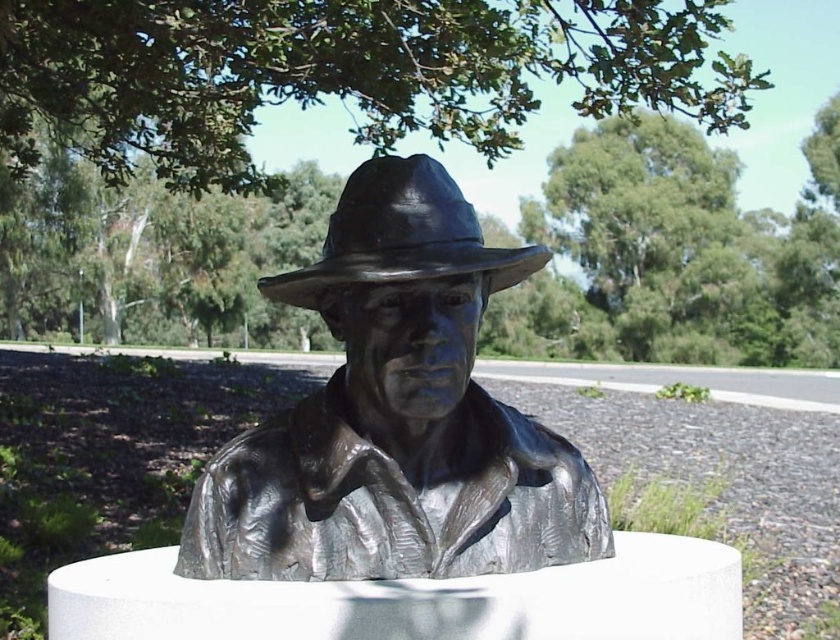
You are a photographer planning to take a wide shot of the bronze statue at center and the shiny black fedora at center. If your camera can only capture objects up to 1.2 meters wide, will both fit in the frame?

The bronze statue at center might be wider than shiny black fedora at center, so it is uncertain if both will fit within the camera frame. Check the actual width of the statue to confirm.

You are standing in front of the bronze bust sculpture on the white pedestal in the park. You notice two points marked in the image at coordinates point [376,305] and point [496,253]. Which point is closer to you as you face the sculpture?

Point [376,305] is in front of point [496,253], so it is closer to you as you face the sculpture.

You are a park visitor standing in front of the bronze statue at center. You want to take a photo of the statue without any obstructions. Is the green leafy tree at upper center blocking the top of the statue?

The bronze statue at center is below the green leafy tree at upper center, so the tree is blocking the top of the statue. To take an unobstructed photo, you should move to a position where the tree is no longer in front of the statue.